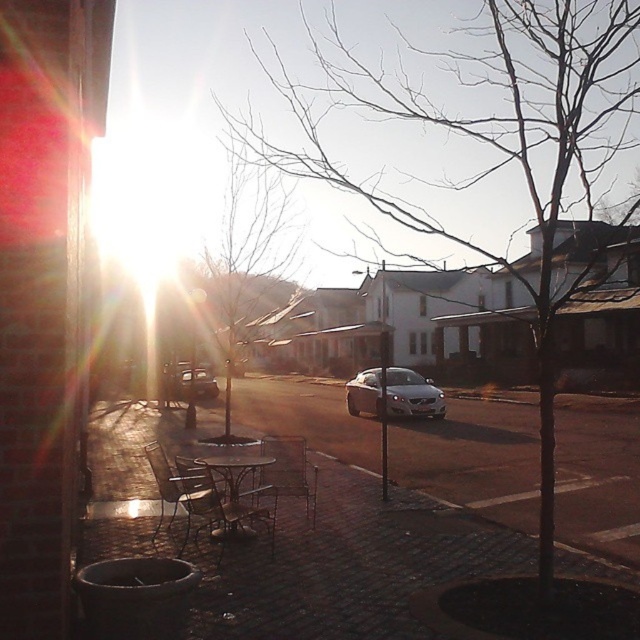
You are a customer at the outdoor seating area and want to sit at the metallic silver chair at center. However, there is a metallic silver chair at lower left blocking your path. Can you walk around it to reach your desired seat?

The metallic silver chair at lower left is to the left of the metallic silver chair at center. Since the chair at lower left is positioned to the left of the center chair, you can walk around it from the right side to reach the metallic silver chair at center.

You are a delivery person with a 1.5 meter wide cart. You need to navigate through the space between the metallic silver chair at center and the metallic silver sedan at center. Can your cart fit through the gap between them?

The metallic silver chair at center is smaller than the metallic silver sedan at center, but the exact distance between them isn not specified. Without knowing the gap size, it is impossible to determine if the cart can fit.